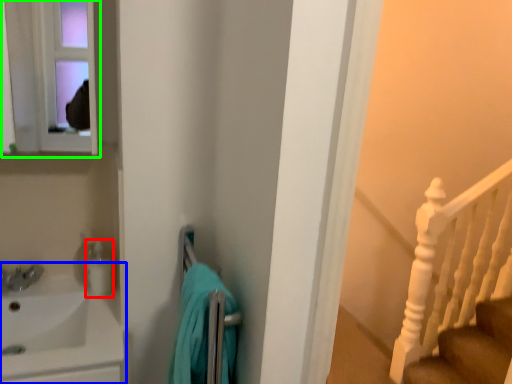
Question: Which object is the closest to the toiletry (highlighted by a red box)? Choose among these: sink (highlighted by a blue box) or medicine cabinet (highlighted by a green box).

Choices:
 (A) sink
 (B) medicine cabinet

Answer: (A)